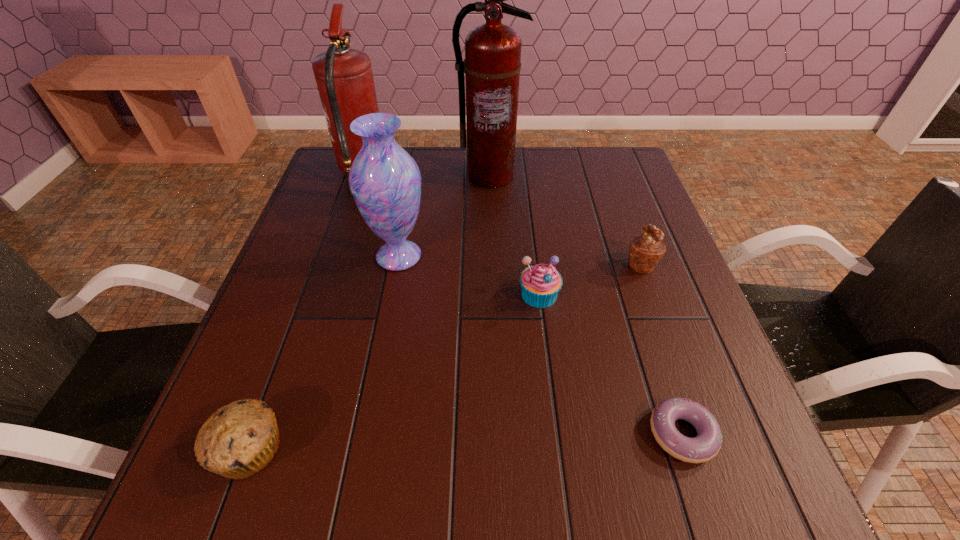
I want to click on vacant region at the far right corner, so click(x=598, y=169).

Identify the location of free space between the left fire extinguisher and the shortest object. This screenshot has height=540, width=960. (522, 305).

Find the location of `free space between the rightmost muffin and the right fire extinguisher`. free space between the rightmost muffin and the right fire extinguisher is located at coordinates (565, 220).

At what (x,y) coordinates should I click in order to perform the action: click on free area in between the left fire extinguisher and the shortest object. Please return your answer as a coordinate pair (x, y). The width and height of the screenshot is (960, 540). Looking at the image, I should click on (522, 305).

I want to click on free space between the rightmost muffin and the left fire extinguisher, so click(502, 220).

At what (x,y) coordinates should I click in order to perform the action: click on unoccupied position between the rightmost muffin and the left fire extinguisher. Please return your answer as a coordinate pair (x, y). The image size is (960, 540). Looking at the image, I should click on (502, 220).

Locate an element on the screen. empty space that is in between the right fire extinguisher and the left fire extinguisher is located at coordinates (426, 176).

Locate an element on the screen. This screenshot has height=540, width=960. free spot between the farthest muffin and the left fire extinguisher is located at coordinates (502, 220).

This screenshot has height=540, width=960. Find the location of `blank region between the nearest muffin and the farthest muffin`. blank region between the nearest muffin and the farthest muffin is located at coordinates (445, 357).

This screenshot has width=960, height=540. I want to click on free space between the third nearest object and the right fire extinguisher, so click(x=515, y=235).